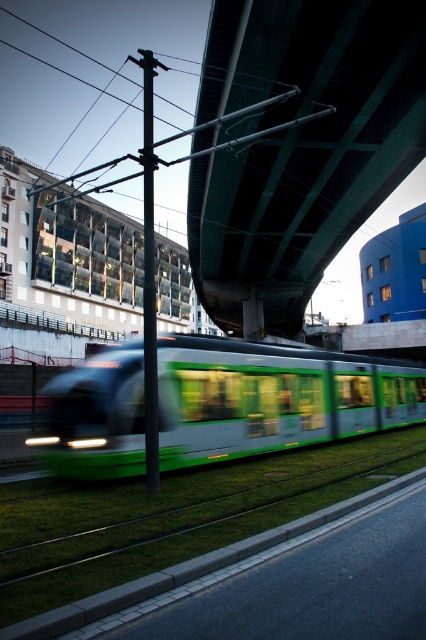
Question: Can you confirm if green concrete bridge at upper center is positioned below green metallic train at center?

Choices:
 (A) no
 (B) yes

Answer: (A)

Question: Is green concrete bridge at upper center to the left of green metallic train at center from the viewer's perspective?

Choices:
 (A) yes
 (B) no

Answer: (B)

Question: Which point appears farthest from the camera in this image?

Choices:
 (A) (193, 385)
 (B) (256, 188)

Answer: (B)

Question: In this image, where is green concrete bridge at upper center located relative to green metallic train at center?

Choices:
 (A) left
 (B) right

Answer: (B)